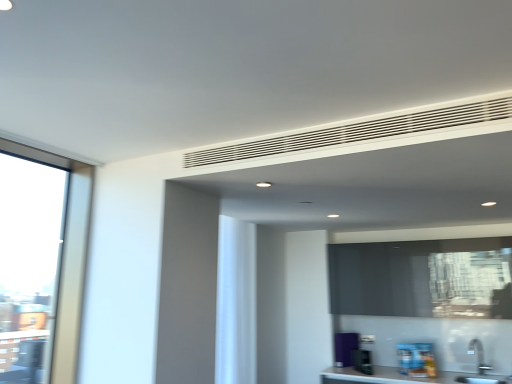
Question: Does white matte vent at upper center have a lesser height compared to white matte curtain at center?

Choices:
 (A) no
 (B) yes

Answer: (B)

Question: Is white matte curtain at center at the back of white matte vent at upper center?

Choices:
 (A) no
 (B) yes

Answer: (A)

Question: Can you confirm if white matte vent at upper center is thinner than white matte curtain at center?

Choices:
 (A) no
 (B) yes

Answer: (B)

Question: Does white matte vent at upper center have a smaller size compared to white matte curtain at center?

Choices:
 (A) no
 (B) yes

Answer: (B)

Question: Is white matte vent at upper center positioned in front of white matte curtain at center?

Choices:
 (A) yes
 (B) no

Answer: (A)

Question: Is white matte vent at upper center further to the viewer compared to white matte curtain at center?

Choices:
 (A) yes
 (B) no

Answer: (B)

Question: Considering the relative positions of green plastic toaster at lower center, the second appliance in the right-to-left sequence, and purple matte refrigerator at lower right, which is the first appliance from left to right, in the image provided, is green plastic toaster at lower center, the second appliance in the right-to-left sequence, to the left of purple matte refrigerator at lower right, which is the first appliance from left to right, from the viewer's perspective?

Choices:
 (A) yes
 (B) no

Answer: (B)

Question: Does green plastic toaster at lower center, positioned as the 2th appliance in back-to-front order, contain purple matte refrigerator at lower right, marked as the 3th appliance in a front-to-back arrangement?

Choices:
 (A) yes
 (B) no

Answer: (B)

Question: Are green plastic toaster at lower center, marked as the second appliance in a front-to-back arrangement, and purple matte refrigerator at lower right, marked as the 3th appliance in a front-to-back arrangement, located far from each other?

Choices:
 (A) yes
 (B) no

Answer: (B)

Question: From a real-world perspective, is green plastic toaster at lower center, the second appliance in the right-to-left sequence, under purple matte refrigerator at lower right, which is the first appliance from left to right?

Choices:
 (A) yes
 (B) no

Answer: (A)

Question: Is green plastic toaster at lower center, marked as the second appliance in a front-to-back arrangement, next to purple matte refrigerator at lower right, which ranks as the 3th appliance in right-to-left order, and touching it?

Choices:
 (A) yes
 (B) no

Answer: (B)

Question: Can you confirm if green plastic toaster at lower center, positioned as the 2th appliance in back-to-front order, is smaller than purple matte refrigerator at lower right, which is the first appliance from left to right?

Choices:
 (A) no
 (B) yes

Answer: (B)

Question: Considering the relative sizes of green plastic toaster at lower center, marked as the second appliance in a front-to-back arrangement, and black matte window screen at center in the image provided, is green plastic toaster at lower center, marked as the second appliance in a front-to-back arrangement, taller than black matte window screen at center?

Choices:
 (A) yes
 (B) no

Answer: (B)